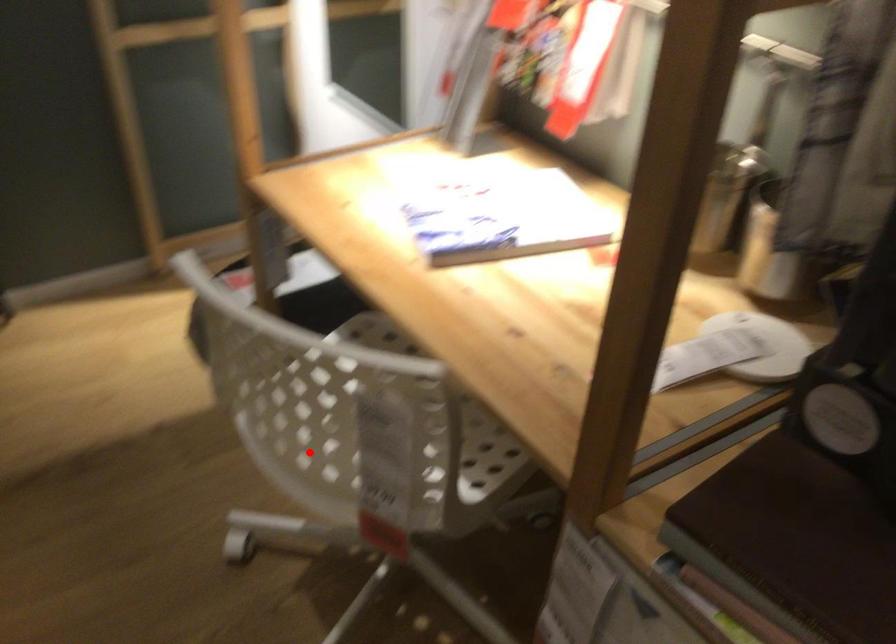
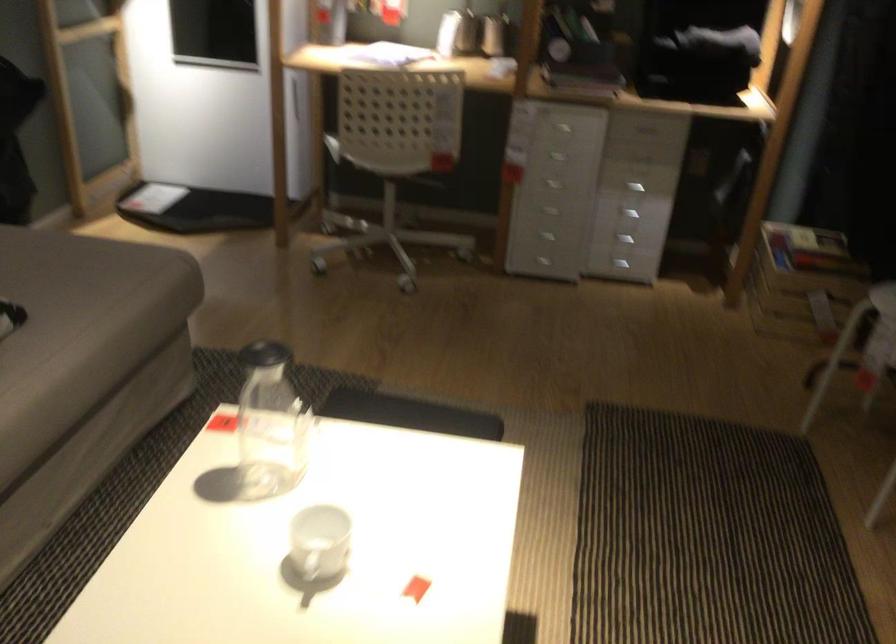
In the second image, find the point that corresponds to the highlighted location in the first image.

(388, 158)